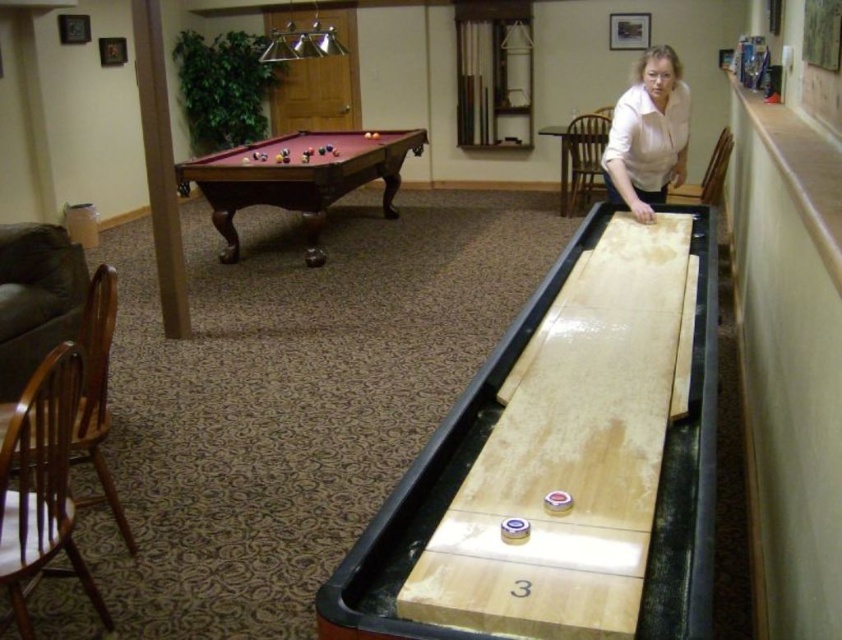
Describe the element at coordinates (430, 486) in the screenshot. This screenshot has height=640, width=842. I see `light brown wood billiard table at center` at that location.

Is light brown wood billiard table at center above white smooth shirt at upper right?

Incorrect, light brown wood billiard table at center is not positioned above white smooth shirt at upper right.

The width and height of the screenshot is (842, 640). Identify the location of light brown wood billiard table at center. (430, 486).

The image size is (842, 640). What are the coordinates of `light brown wood billiard table at center` in the screenshot? It's located at (430, 486).

In order to click on mahogany wood billiard table at left in this screenshot , I will do `click(297, 177)`.

Between point (347, 177) and point (633, 211), which one is positioned in front?

Point (633, 211)

Identify the location of mahogany wood billiard table at left. The height and width of the screenshot is (640, 842). (297, 177).

Where is `mahogany wood billiard table at left`? The width and height of the screenshot is (842, 640). mahogany wood billiard table at left is located at coordinates (297, 177).

Between point (653, 540) and point (338, 195), which one is positioned behind?

Point (338, 195)

Does light brown wood billiard table at center appear on the left side of mahogany wood billiard table at left?

No, light brown wood billiard table at center is not to the left of mahogany wood billiard table at left.

Is point (677, 557) positioned behind point (348, 179)?

No, it is in front of (348, 179).

I want to click on light brown wood billiard table at center, so click(x=430, y=486).